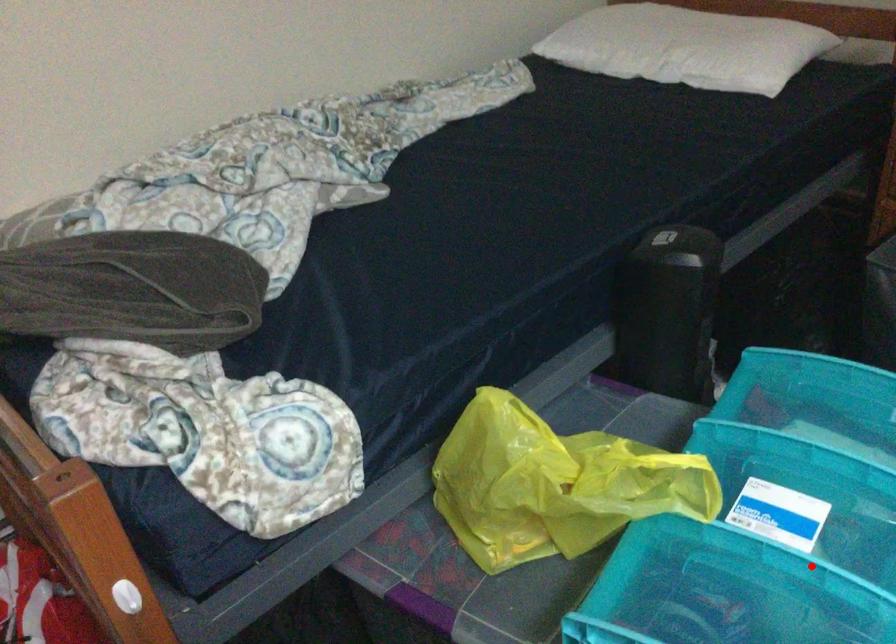
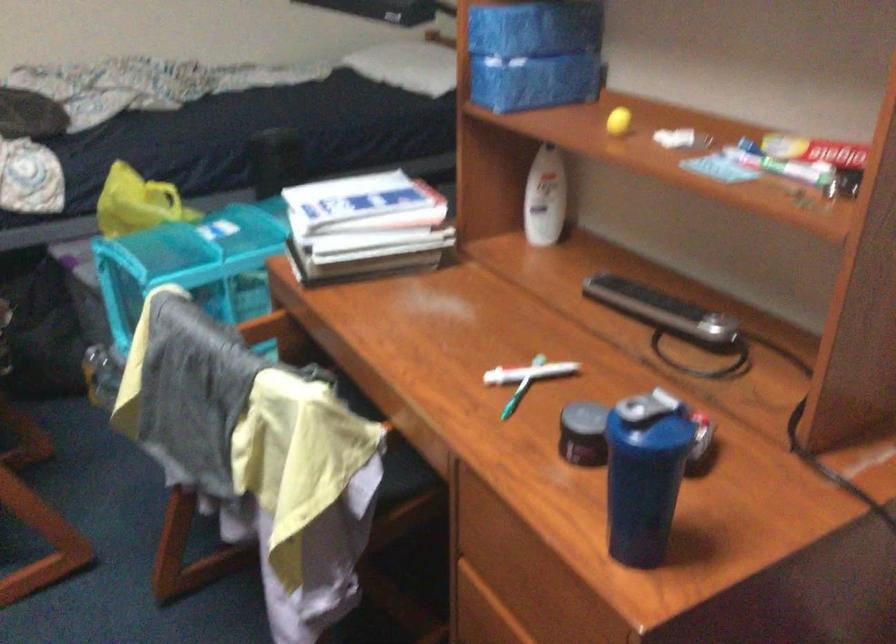
Question: I am providing you with two images of the same scene from different viewpoints. Given a red point in image1, look at the same physical point in image2. Is it:

Choices:
 (A) Closer to the viewpoint
 (B) Farther from the viewpoint

Answer: (B)